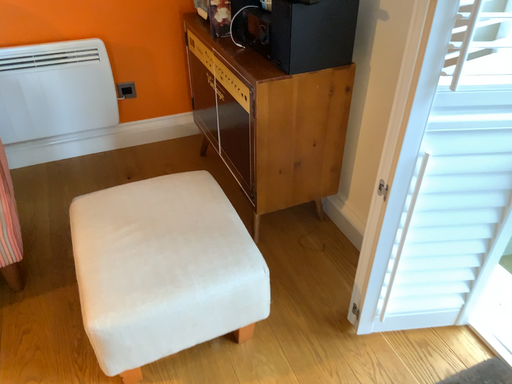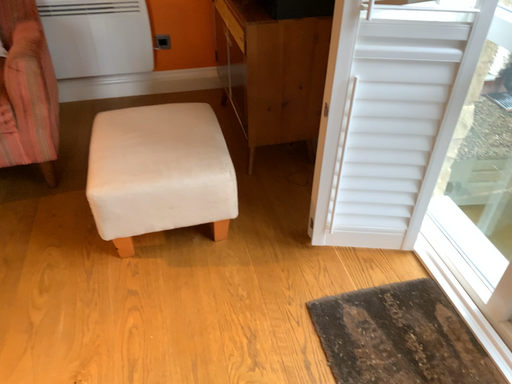
Question: Which way did the camera rotate in the video?

Choices:
 (A) rotated right
 (B) rotated left

Answer: (B)